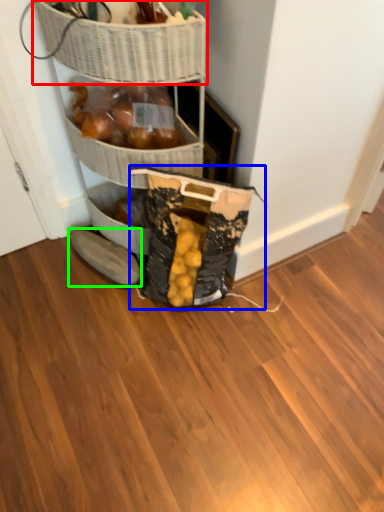
Question: Which object is the closest to the basket (highlighted by a red box)? Choose among these: material (highlighted by a blue box) or footwear (highlighted by a green box).

Choices:
 (A) material
 (B) footwear

Answer: (A)